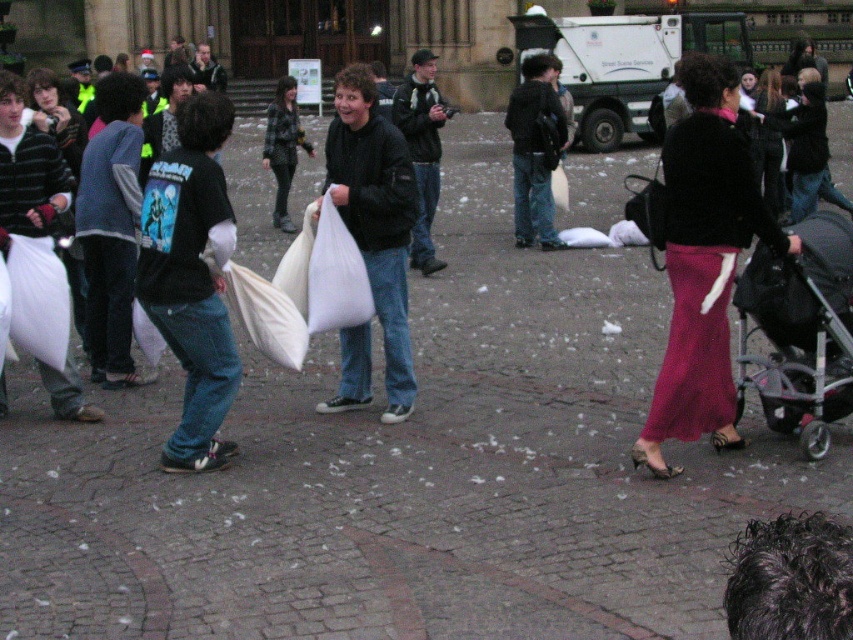
You are standing in the middle of the square looking at the scene. There is a point at coordinates [703,260]. What object is located at that point?

The point at coordinates [703,260] indicates the location of the matte black sweater at center.

You are organizing a small event in this courtyard and need to place a 1.2 meter wide banner between the matte black sweater at center and the black plastic stroller at lower right. Can the space between them accommodate the banner?

The matte black sweater at center is wider than the black plastic stroller at lower right. However, the question is about the space between them, not their widths. Without information on the distance between them, we cannot determine if the banner will fit. Please provide more details about the distance between the two objects.